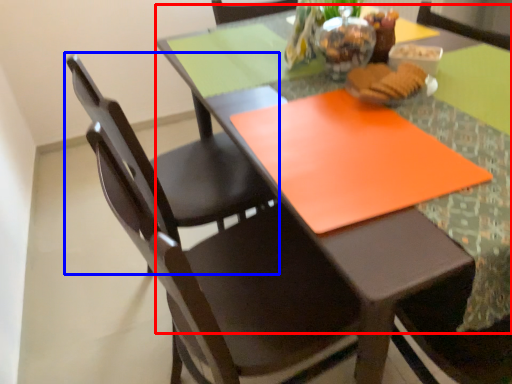
Question: Which object appears farthest to the camera in this image, round table (highlighted by a red box) or chair (highlighted by a blue box)?

Choices:
 (A) round table
 (B) chair

Answer: (B)